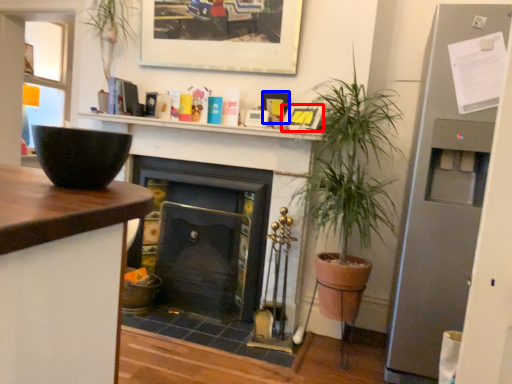
Question: Which of the following is the closest to the observer, picture frame (highlighted by a red box) or picture frame (highlighted by a blue box)?

Choices:
 (A) picture frame
 (B) picture frame

Answer: (A)